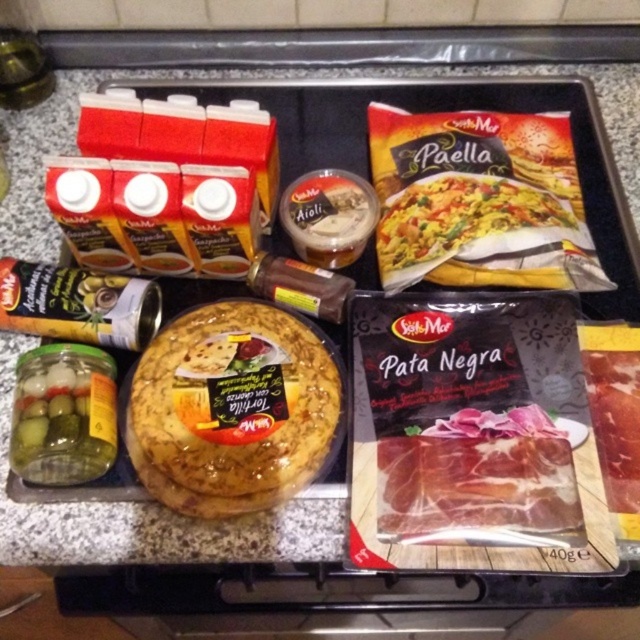
Which is behind, point (211, 484) or point (522, 237)?

The point (522, 237) is behind.

Image resolution: width=640 pixels, height=640 pixels. In order to click on translucent plastic tortilla at center in this screenshot , I will do `click(230, 408)`.

Between point (170, 381) and point (534, 497), which one is positioned in front?

Point (534, 497)

How much distance is there between translucent plastic tortilla at center and semi-dry cured ham at center?

They are 6.31 inches apart.

Find the location of `translucent plastic tortilla at center`. translucent plastic tortilla at center is located at coordinates (230, 408).

Image resolution: width=640 pixels, height=640 pixels. I want to click on translucent plastic tortilla at center, so click(x=230, y=408).

Who is more forward, (440, 464) or (384, 220)?

Point (440, 464)

Who is taller, semi-dry cured ham at center or yellow matte paella packet at upper right?

yellow matte paella packet at upper right is taller.

Is point (561, 424) farther from viewer compared to point (577, 248)?

No, it is in front of (577, 248).

This screenshot has height=640, width=640. In order to click on semi-dry cured ham at center in this screenshot , I will do `click(481, 481)`.